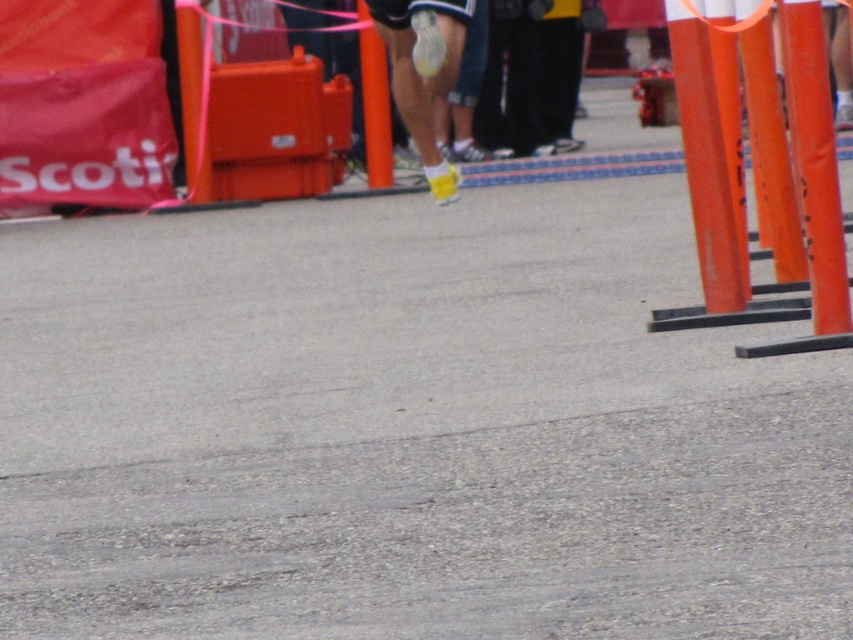
You are a photographer standing at the starting line of a marathon. You notice the yellow matte socks at center and the orange plastic pole at center in your viewfinder. Which object should you focus on to ensure it appears clearer in the photo?

The yellow matte socks at center is closer to the viewer than the orange plastic pole at center, so focusing on the yellow matte socks at center will ensure it appears clearer in the photo.

You are a runner in a marathon and you see two points marked on the asphalt road. The first point is at coordinate point (686, 173) and the second point is at coordinate point (399, 51). Which point is closer to you as you run forward?

Point (399, 51) is closer to you because it is in front of point (686, 173), which is behind it.